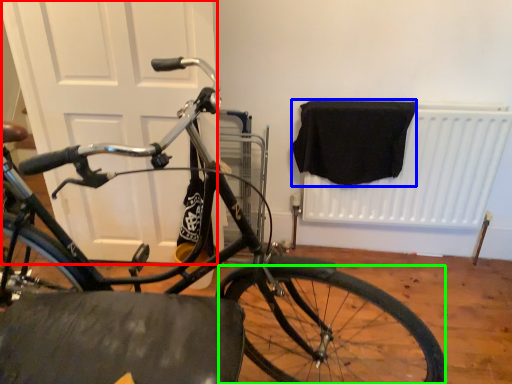
Question: Which is farther away from door (highlighted by a red box)? blanket (highlighted by a blue box) or bicycle wheel (highlighted by a green box)?

Choices:
 (A) blanket
 (B) bicycle wheel

Answer: (B)